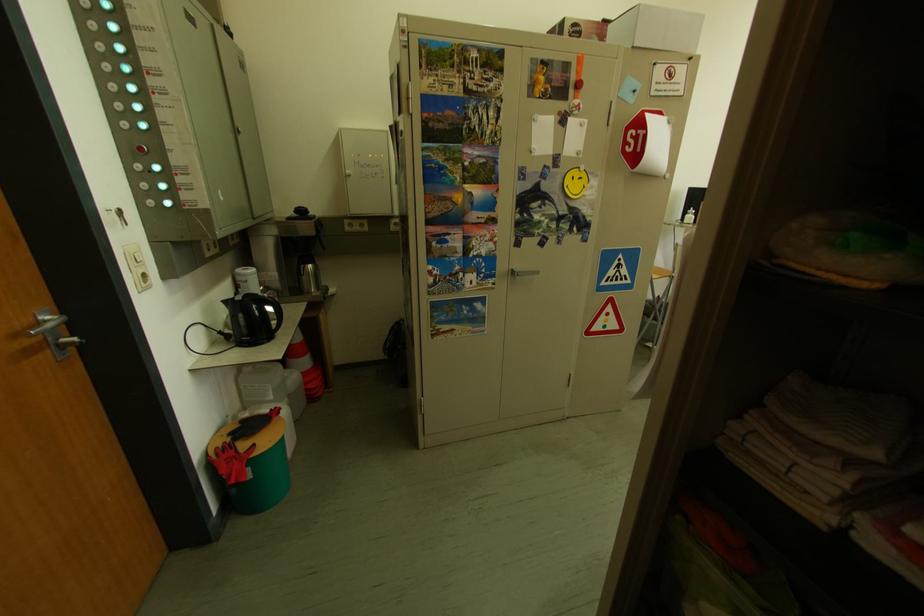
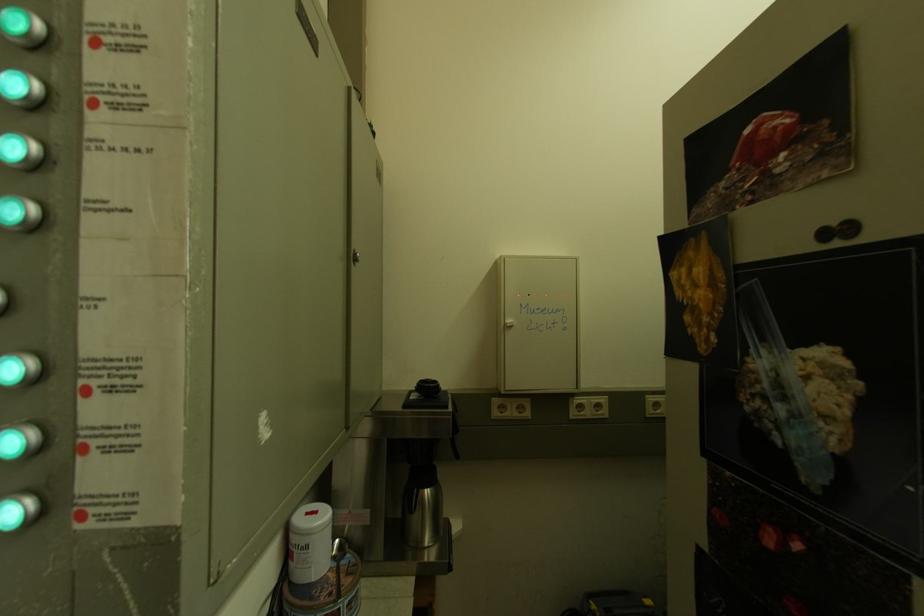
What movement of the cameraman would produce the second image?

The cameraman moved toward left, forward.